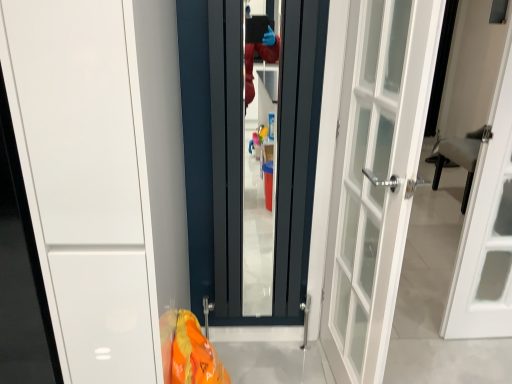
The height and width of the screenshot is (384, 512). What do you see at coordinates (188, 351) in the screenshot?
I see `orange fabric grocery bag at lower center` at bounding box center [188, 351].

What is the approximate width of orange fabric grocery bag at lower center?

15.41 inches.

Find the location of `orange fabric grocery bag at lower center`. orange fabric grocery bag at lower center is located at coordinates (188, 351).

The image size is (512, 384). What are the coordinates of `orange fabric grocery bag at lower center` in the screenshot? It's located at (188, 351).